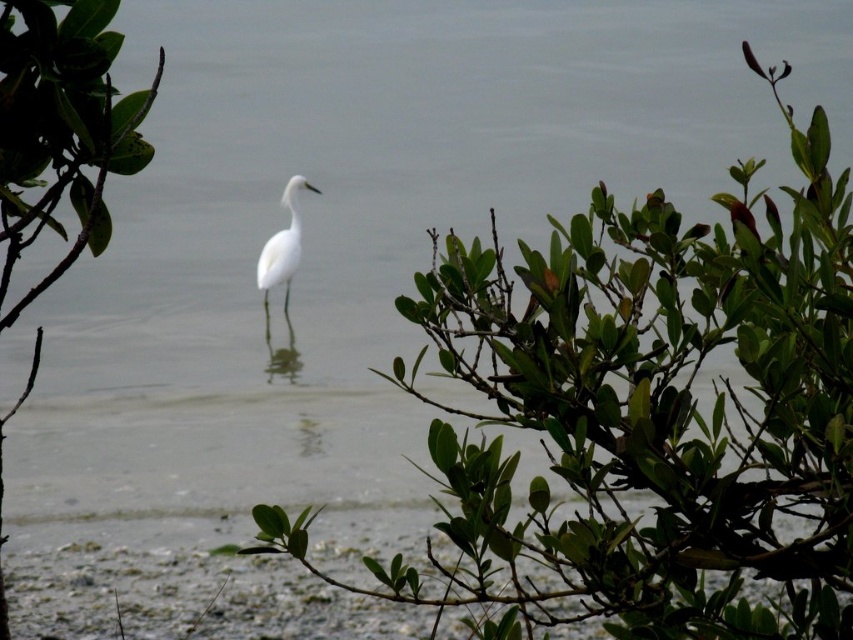
Who is higher up, green leafy shrub at center-left or white matte bird at center?

white matte bird at center is above.

Between point (76, 156) and point (259, 276), which one is positioned behind?

The point (259, 276) is behind.

Is point (39, 35) positioned behind point (268, 244)?

No, it is in front of (268, 244).

What are the coordinates of `green leafy shrub at center-left` in the screenshot? It's located at (61, 125).

Does green leafy shrub at center appear over green leafy shrub at center-left?

Incorrect, green leafy shrub at center is not positioned above green leafy shrub at center-left.

Measure the distance between green leafy shrub at center and camera.

green leafy shrub at center is 1.39 meters from camera.

Locate an element on the screen. The width and height of the screenshot is (853, 640). green leafy shrub at center is located at coordinates (648, 413).

In the scene shown: Who is positioned more to the right, green leafy shrub at center or white matte bird at center?

From the viewer's perspective, green leafy shrub at center appears more on the right side.

Can you confirm if green leafy shrub at center is positioned below white matte bird at center?

Indeed, green leafy shrub at center is positioned under white matte bird at center.

Is point (724, 561) closer to camera compared to point (311, 186)?

Yes, point (724, 561) is closer to viewer.

Image resolution: width=853 pixels, height=640 pixels. I want to click on green leafy shrub at center, so click(x=648, y=413).